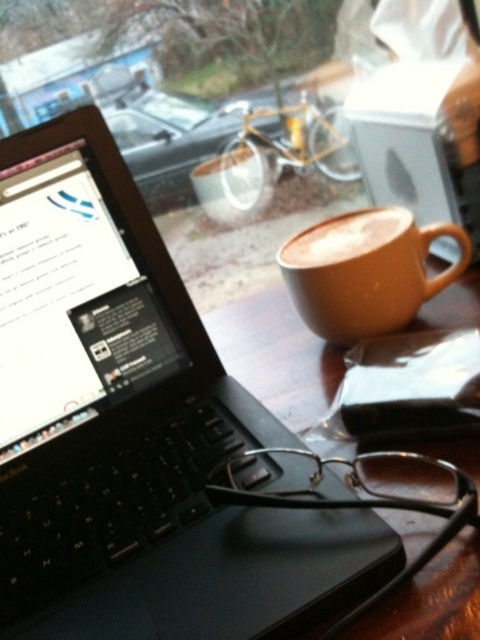
Does black matte laptop at left have a lesser height compared to matte brown mug at center?

Incorrect, black matte laptop at left's height does not fall short of matte brown mug at center's.

Can you confirm if black matte laptop at left is smaller than matte brown mug at center?

Actually, black matte laptop at left might be larger than matte brown mug at center.

Is point (322, 595) positioned after point (305, 241)?

No.

Locate an element on the screen. This screenshot has height=640, width=480. black matte laptop at left is located at coordinates (134, 429).

Is black matte laptop at left below brown matte cup at center?

Yes, black matte laptop at left is below brown matte cup at center.

Between black matte laptop at left and brown matte cup at center, which one appears on the left side from the viewer's perspective?

black matte laptop at left is more to the left.

At what (x,y) coordinates should I click in order to perform the action: click on black matte laptop at left. Please return your answer as a coordinate pair (x, y). This screenshot has width=480, height=640. Looking at the image, I should click on (134, 429).

Describe the element at coordinates (134, 429) in the screenshot. I see `black matte laptop at left` at that location.

Is black matte laptop at left positioned at the back of wooden table at center?

Yes, black matte laptop at left is further from the viewer.

Between point (104, 278) and point (468, 323), which one is positioned in front?

Positioned in front is point (104, 278).

The image size is (480, 640). Identify the location of black matte laptop at left. (134, 429).